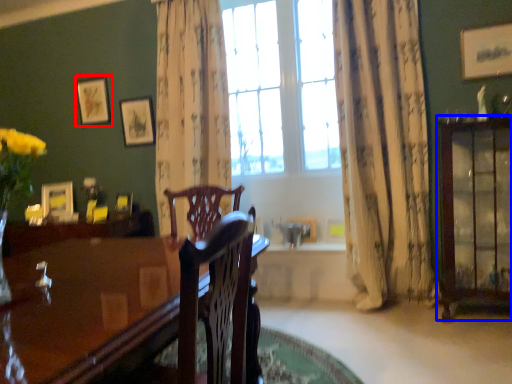
Question: Which of the following is the closest to the observer, picture frame (highlighted by a red box) or cabinetry (highlighted by a blue box)?

Choices:
 (A) picture frame
 (B) cabinetry

Answer: (B)